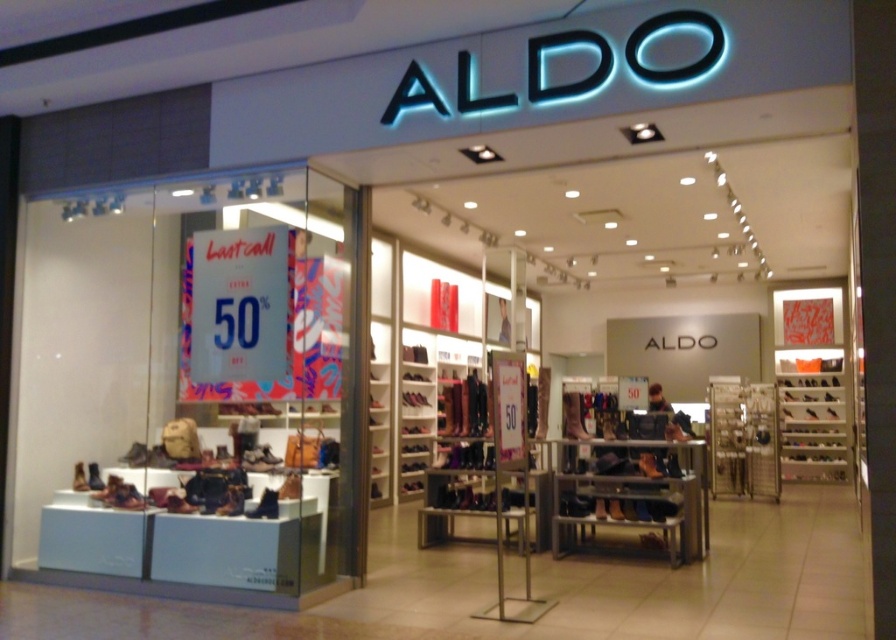
Which is more to the right, matte black shoe at lower center or matte black boot at lower left?

matte black shoe at lower center

Is point (257, 512) closer to camera compared to point (83, 483)?

That is True.

Identify the location of matte black shoe at lower center. (265, 506).

Looking at this image, which is above, matte black shoe at lower center or matte brown boot at lower left?

matte brown boot at lower left

Can you confirm if matte black shoe at lower center is positioned to the left of matte brown boot at lower left?

Incorrect, matte black shoe at lower center is not on the left side of matte brown boot at lower left.

Is point (265, 492) positioned in front of point (87, 468)?

Yes.

Where is `matte black shoe at lower center`? Image resolution: width=896 pixels, height=640 pixels. matte black shoe at lower center is located at coordinates (265, 506).

Does matte brown shoe at lower left appear on the right side of matte black boot at lower left?

Indeed, matte brown shoe at lower left is positioned on the right side of matte black boot at lower left.

Between matte brown shoe at lower left and matte black boot at lower left, which one is positioned higher?

matte black boot at lower left is above.

Does point (185, 509) lie behind point (82, 472)?

No, (185, 509) is in front of (82, 472).

Locate an element on the screen. The image size is (896, 640). matte brown shoe at lower left is located at coordinates point(178,502).